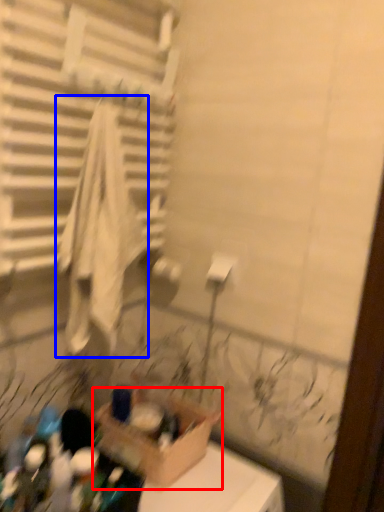
Question: Among these objects, which one is farthest to the camera, cardboard box (highlighted by a red box) or bath towel (highlighted by a blue box)?

Choices:
 (A) cardboard box
 (B) bath towel

Answer: (A)